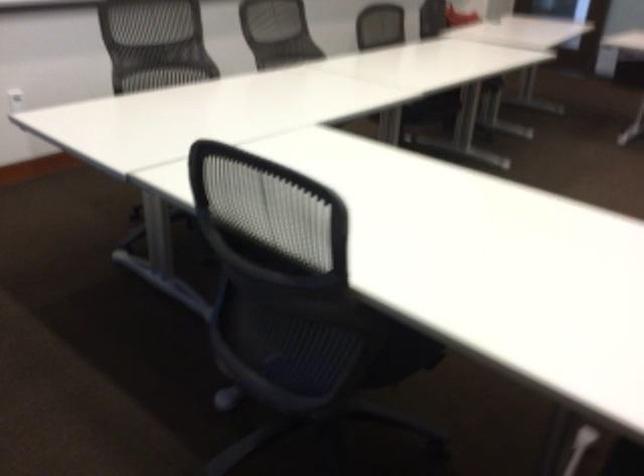
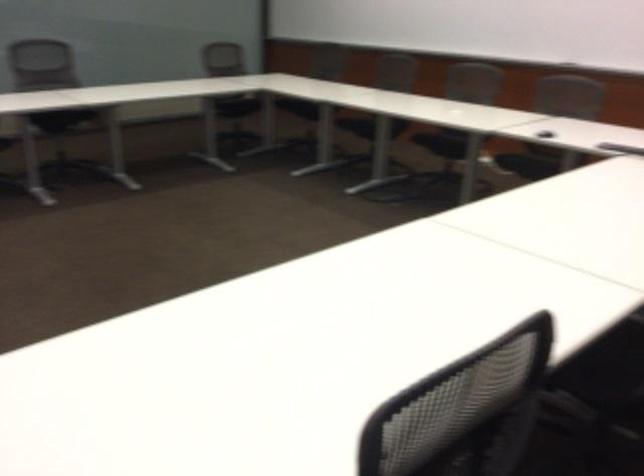
Question: The images are taken continuously from a first-person perspective. In which direction are you moving?

Choices:
 (A) Left
 (B) Right
 (C) Forward
 (D) Backward

Answer: (D)